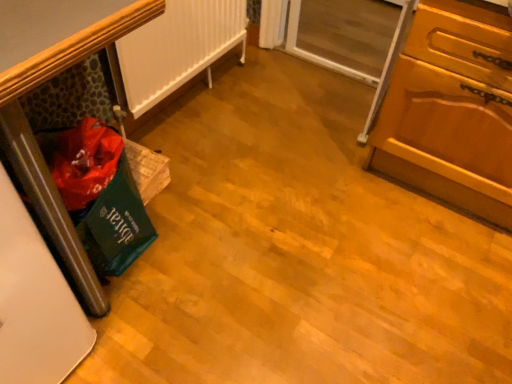
Locate an element on the screen. free space between wooden cabinet at right and white matte radiator at left is located at coordinates (281, 134).